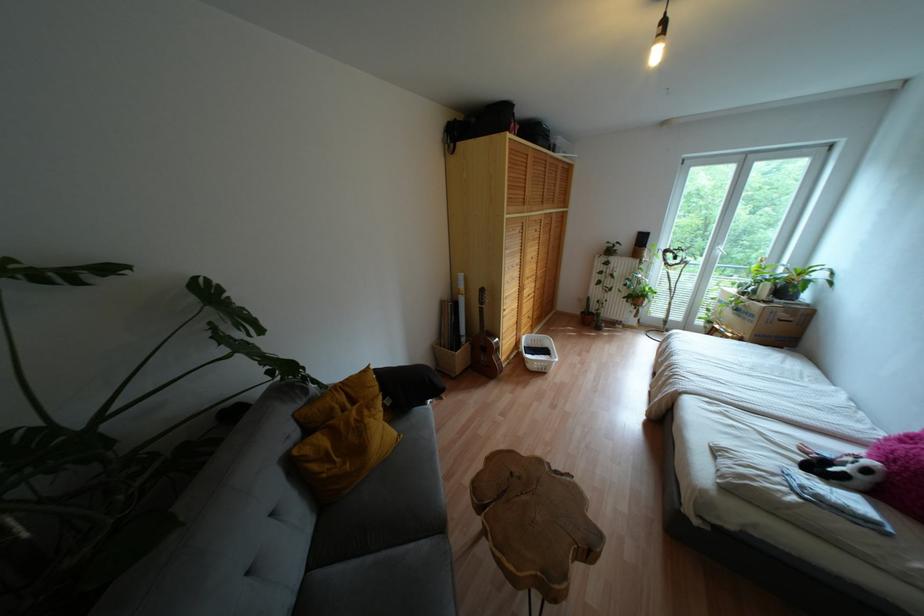
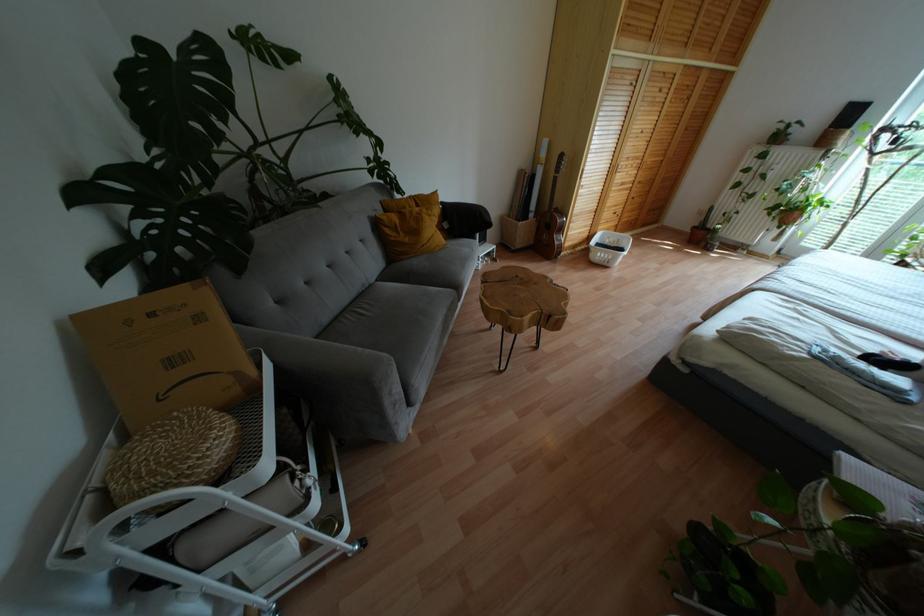
In the second image, find the point that corresponds to point 580,313 in the first image.

(694, 227)